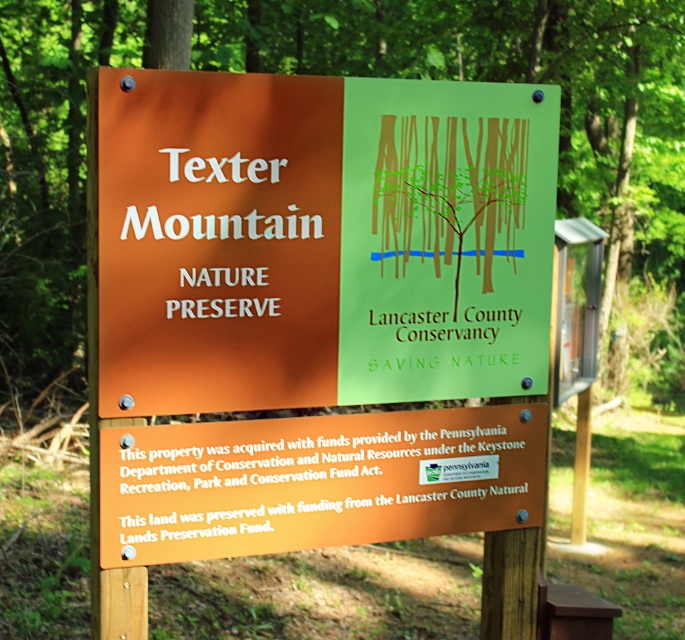
Question: Which point is closer to the camera?

Choices:
 (A) green matte signboard at center
 (B) matte orange sign at center

Answer: (B)

Question: Is the position of matte orange sign at center less distant than that of green matte signboard at center?

Choices:
 (A) yes
 (B) no

Answer: (A)

Question: In this image, where is matte orange sign at center located relative to green matte signboard at center?

Choices:
 (A) right
 (B) left

Answer: (B)

Question: Which point is closer to the camera?

Choices:
 (A) green matte signboard at center
 (B) matte orange sign at center

Answer: (B)

Question: Can you confirm if matte orange sign at center is bigger than green matte signboard at center?

Choices:
 (A) yes
 (B) no

Answer: (A)

Question: Which point is closer to the camera?

Choices:
 (A) (166, 508)
 (B) (647, 12)

Answer: (A)